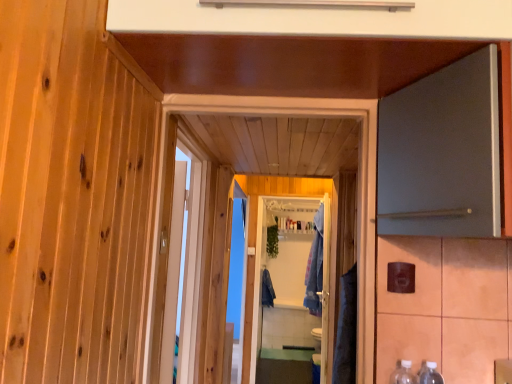
Question: Is white wooden door at center, positioned as the 1th door in left-to-right order, wider or thinner than denim robe at center, which is the 1th robe from front to back?

Choices:
 (A) thin
 (B) wide

Answer: (A)

Question: In the image, is white wooden door at center, marked as the second door in a right-to-left arrangement, positioned in front of or behind denim robe at center, which ranks as the second robe in back-to-front order?

Choices:
 (A) front
 (B) behind

Answer: (A)

Question: Based on their relative distances, which object is nearer to the matte gray cabinet at right, which appears as the 2th door when viewed from the left?

Choices:
 (A) white glossy screen door at center
 (B) clear plastic bottles at lower right, which is counted as the first bottle, starting from the left
 (C) clear plastic bottles at lower right, positioned as the second bottle in left-to-right order
 (D) denim robe at center, the 1th robe viewed from the right
 (E) dark blue fabric at center, the first robe viewed from the back

Answer: (B)

Question: Based on their relative distances, which object is farther from the denim robe at center, which is the 1th robe from front to back?

Choices:
 (A) white wooden door at center, positioned as the 1th door in left-to-right order
 (B) matte gray cabinet at right, which appears as the 2th door when viewed from the left
 (C) white glossy screen door at center
 (D) clear plastic bottles at lower right, which is the first bottle from right to left
 (E) clear plastic bottles at lower right, which is counted as the first bottle, starting from the left

Answer: (B)